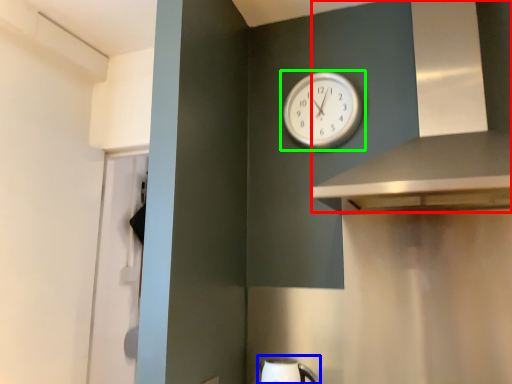
Question: Considering the real-world distances, which object is farthest from vent (highlighted by a red box)? sink (highlighted by a blue box) or wall clock (highlighted by a green box)?

Choices:
 (A) sink
 (B) wall clock

Answer: (A)